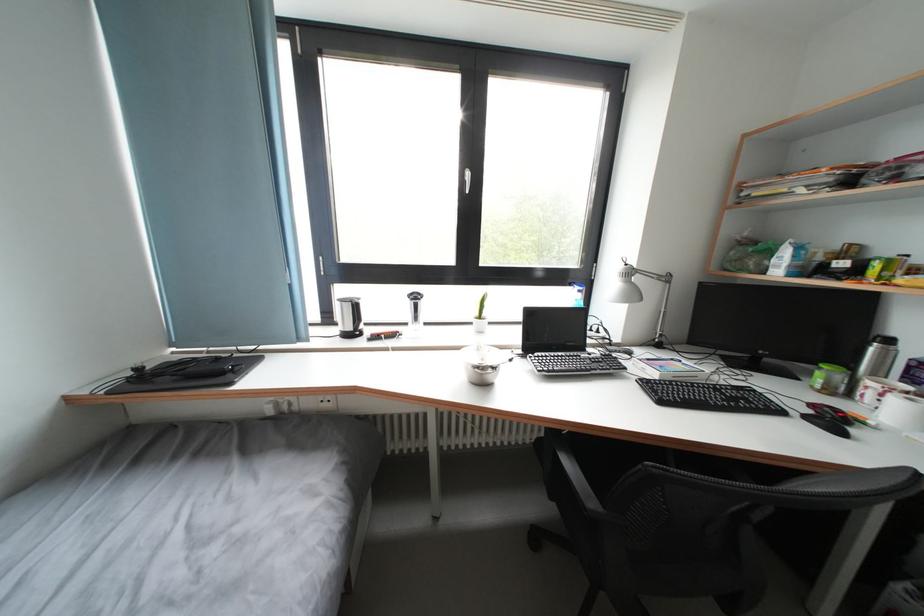
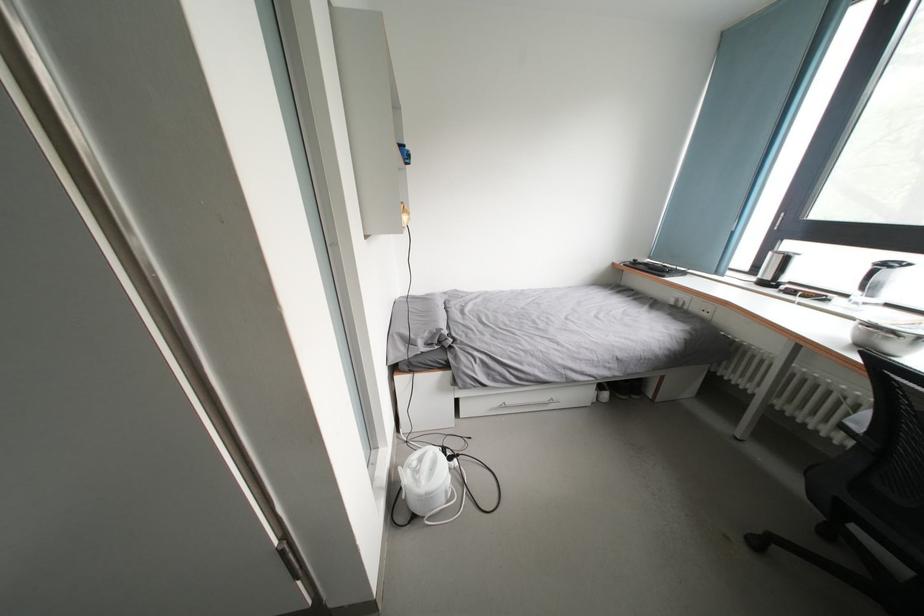
Where in the second image is the point corresponding to [358,333] from the first image?

(774, 283)